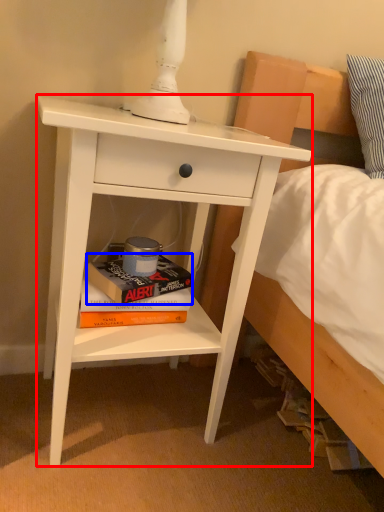
Question: Which object is further to the camera taking this photo, nightstand (highlighted by a red box) or paperback book (highlighted by a blue box)?

Choices:
 (A) nightstand
 (B) paperback book

Answer: (B)